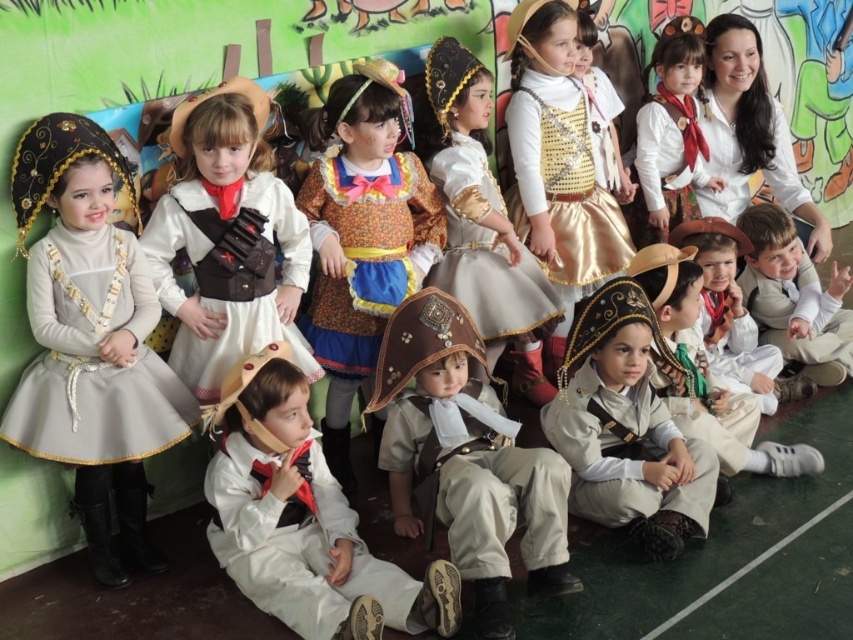
You are a costume designer observing the children in the scene. You need to decide which costume requires more fabric to make between the matte gray dress at left and the white cotton shirt at lower right. Which one would you choose?

The matte gray dress at left has a larger size compared to the white cotton shirt at lower right, so the matte gray dress at left would require more fabric to make.